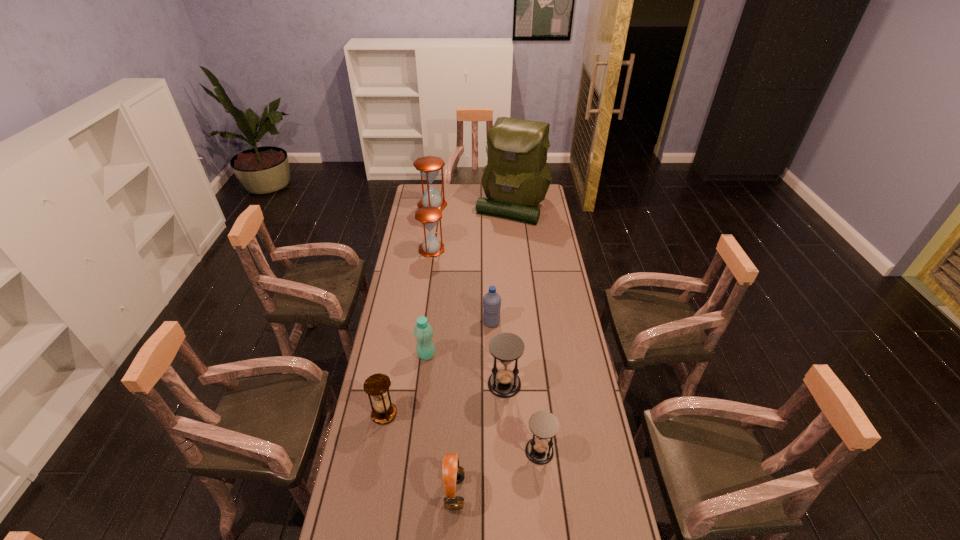
This screenshot has height=540, width=960. I want to click on object present at the far left corner, so click(429, 166).

This screenshot has width=960, height=540. I want to click on object at the far right corner, so click(x=516, y=178).

In the image, there is a desktop. Where is `vacant space at the far edge`? vacant space at the far edge is located at coordinates (440, 194).

At what (x,y) coordinates should I click in order to perform the action: click on vacant position at the left edge of the desktop. Please return your answer as a coordinate pair (x, y). Image resolution: width=960 pixels, height=540 pixels. Looking at the image, I should click on (408, 249).

I want to click on free location at the right edge of the desktop, so (562, 414).

Find the location of a particular element. vacant space at the far left corner of the desktop is located at coordinates (412, 205).

This screenshot has height=540, width=960. I want to click on vacant space in between the fourth nearest hourglass and the bigger black hourglass, so click(x=468, y=316).

What are the coordinates of `vacant area that lies between the seventh nearest object and the smallest brown hourglass` in the screenshot? It's located at (408, 332).

Image resolution: width=960 pixels, height=540 pixels. I want to click on free space between the nearest brown hourglass and the green backpack, so click(448, 310).

The width and height of the screenshot is (960, 540). In order to click on vacant space that's between the fifth object from left to right and the fourth nearest object in this screenshot , I will do tap(480, 438).